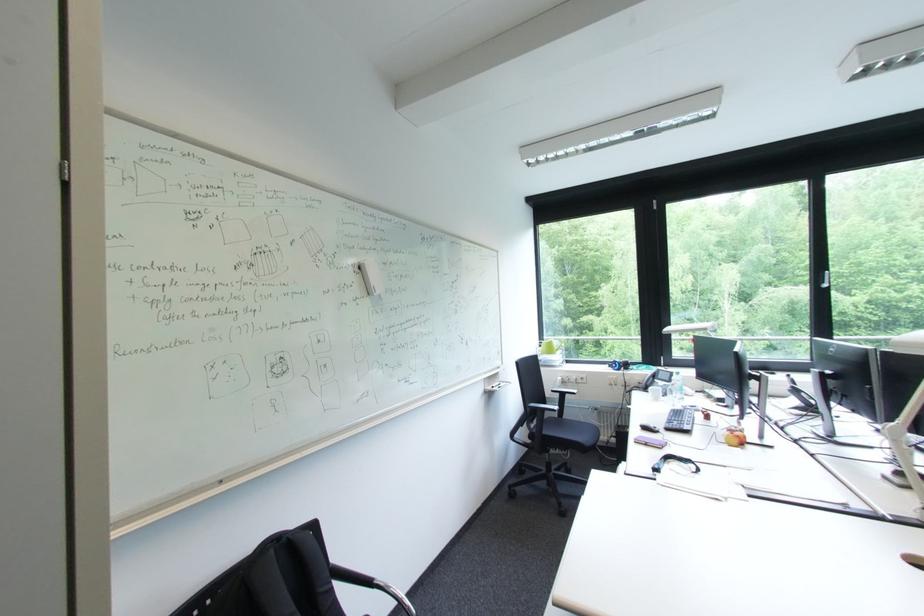
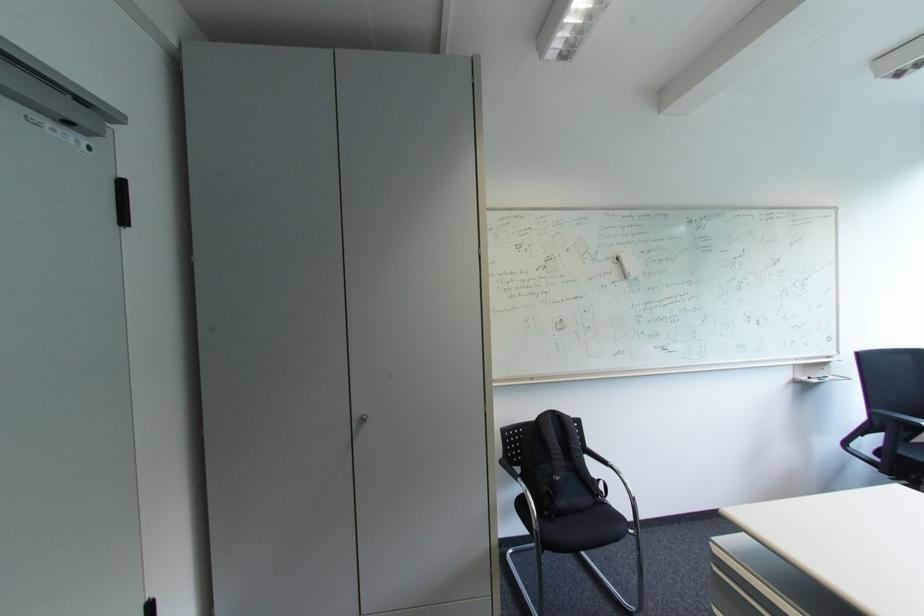
Locate, in the second image, the point that corresponds to the point at 503,389 in the first image.

(819, 379)